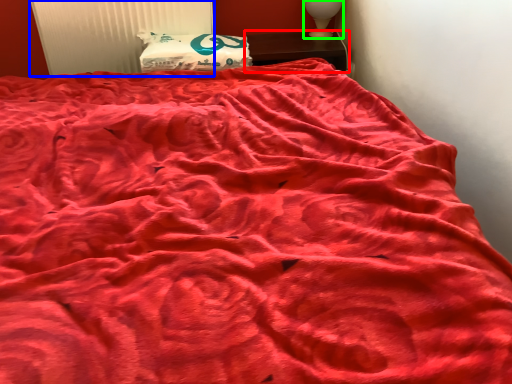
Question: Based on their relative distances, which object is nearer to furniture (highlighted by a red box)? Choose from radiator (highlighted by a blue box) and table lamp (highlighted by a green box).

Choices:
 (A) radiator
 (B) table lamp

Answer: (B)